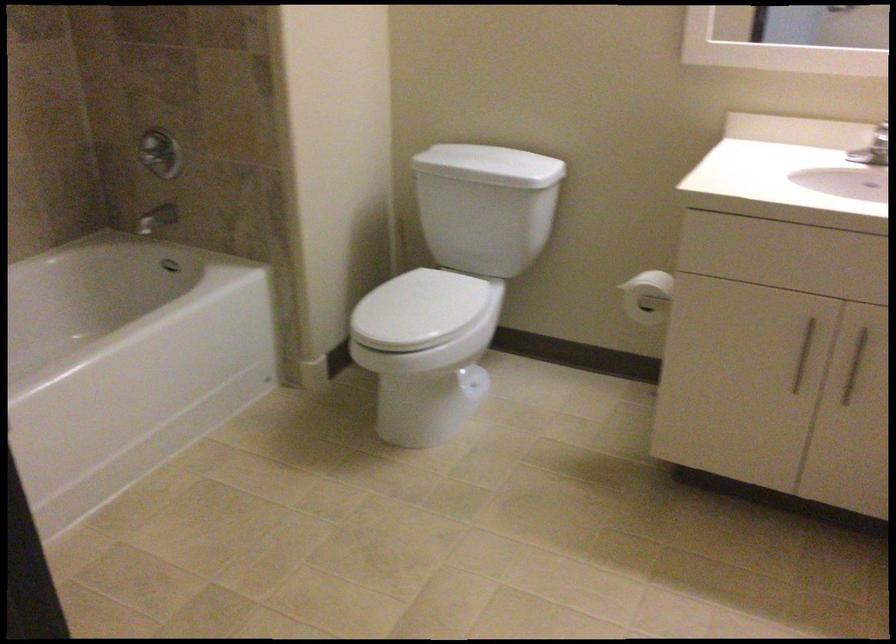
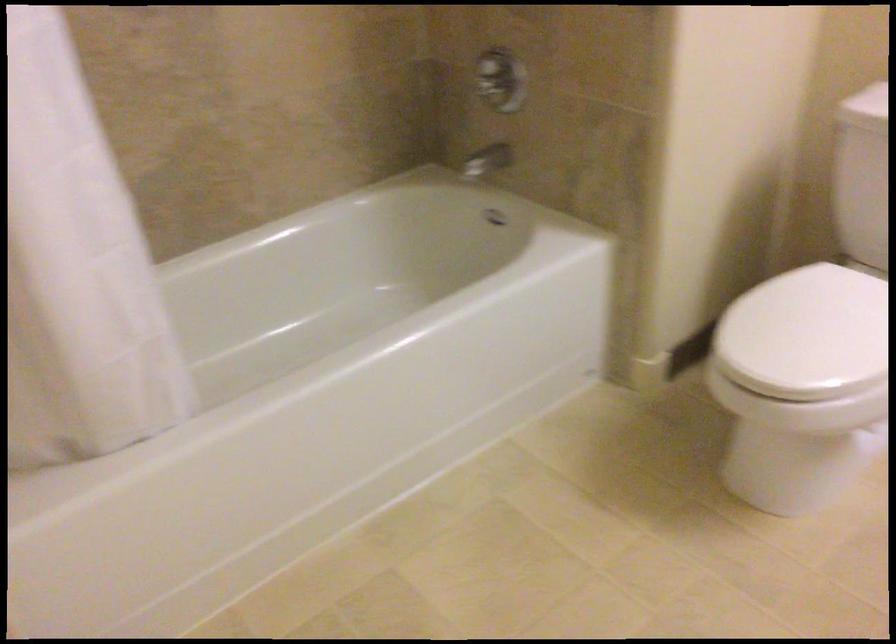
Question: The images are taken continuously from a first-person perspective. In which direction is your viewpoint rotating?

Choices:
 (A) Left
 (B) Right
 (C) Up
 (D) Down

Answer: (A)